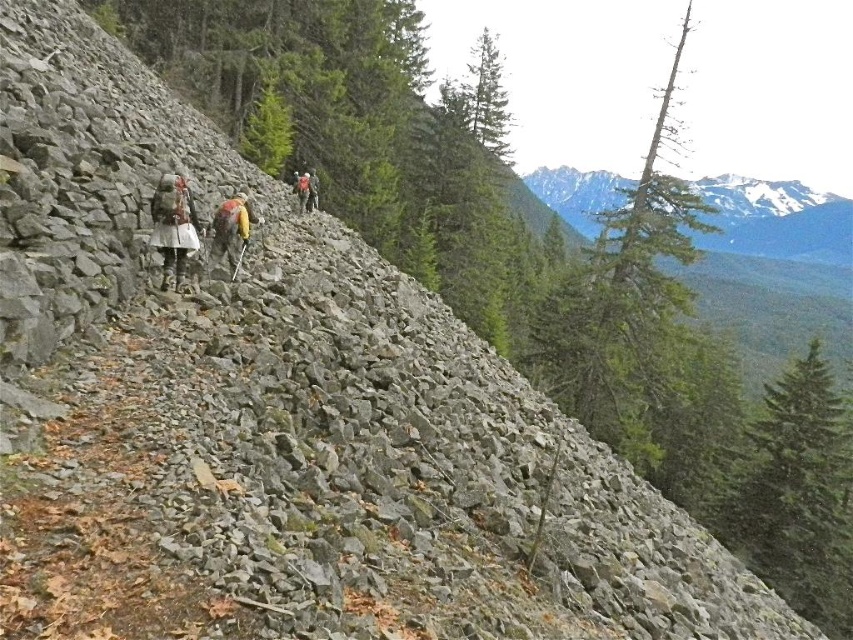
You are a hiker planning to take a photo of both the snowy granite mountain at upper right and the green matte tree at center. Since you want both in the frame, which object should you position closer to the edge of your camera viewfinder to include both?

To include both the snowy granite mountain at upper right and the green matte tree at center in the frame, you should position the snowy granite mountain at upper right closer to the edge of your camera viewfinder since it is on the right side of the green matte tree at center.

You are a hiker planning to take a photo of the snowy granite mountain at upper right. You are currently at the point marked by coordinates point [775,220]. Which direction should you face to capture the mountain in your shot?

The point [775,220] marks the snowy granite mountain at upper right. To capture it in your photo, you should face towards the upper right direction from your current position.

You are a hiker who wants to take a photo of the orange fabric backpack at center while ensuring the green textured pine tree at upper center is visible in the background. Will the pine tree be fully visible behind the backpack?

The green textured pine tree at upper center is bigger than the orange fabric backpack at center. Since the pine tree is larger, it will extend beyond the backpack in the photo, making it fully visible in the background.